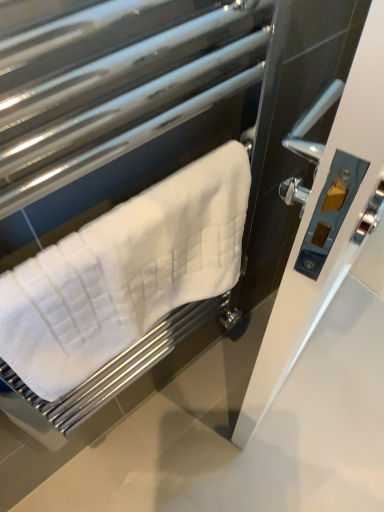
Question: Should I look upward or downward to see white textured towel at left?

Choices:
 (A) up
 (B) down

Answer: (B)